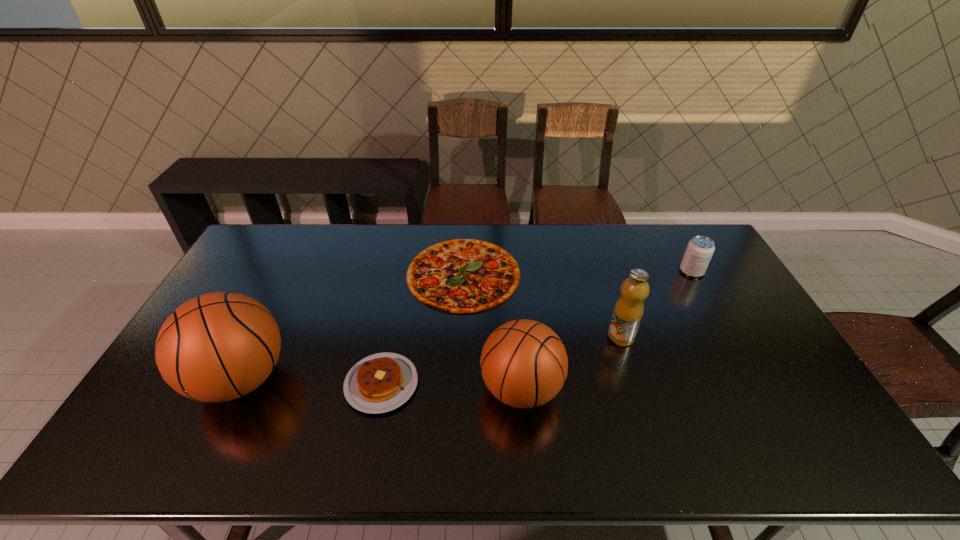
Identify the location of the leftmost object. (217, 347).

Where is `the taller basketball`? the taller basketball is located at coordinates (217, 347).

Where is `the right basketball`? the right basketball is located at coordinates (524, 364).

Find the location of a particular element. The height and width of the screenshot is (540, 960). the rightmost object is located at coordinates (x=699, y=251).

At what (x,y) coordinates should I click in order to perform the action: click on soda can. Please return your answer as a coordinate pair (x, y). Looking at the image, I should click on (699, 251).

Find the location of a particular element. This screenshot has width=960, height=540. the shortest object is located at coordinates (461, 276).

The height and width of the screenshot is (540, 960). What are the coordinates of `the second object from right to left` in the screenshot? It's located at (628, 311).

Find the location of a particular element. The height and width of the screenshot is (540, 960). pancake is located at coordinates (381, 382).

You are a GUI agent. You are given a task and a screenshot of the screen. Output one action in this format:
    pyautogui.click(x=<x>, y=<y>)
    Task: Click on the vacant space located 0.080m on the right of the taller basketball
    
    Given the screenshot: What is the action you would take?
    pyautogui.click(x=321, y=379)

Locate an element on the screen. free space located on the right of the right basketball is located at coordinates (604, 389).